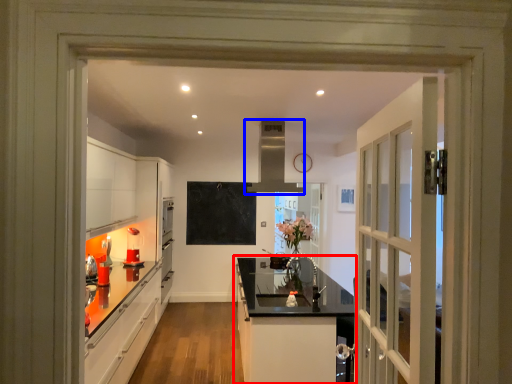
Question: Which object is further to the camera taking this photo, cabinetry (highlighted by a red box) or exhaust hood (highlighted by a blue box)?

Choices:
 (A) cabinetry
 (B) exhaust hood

Answer: (B)